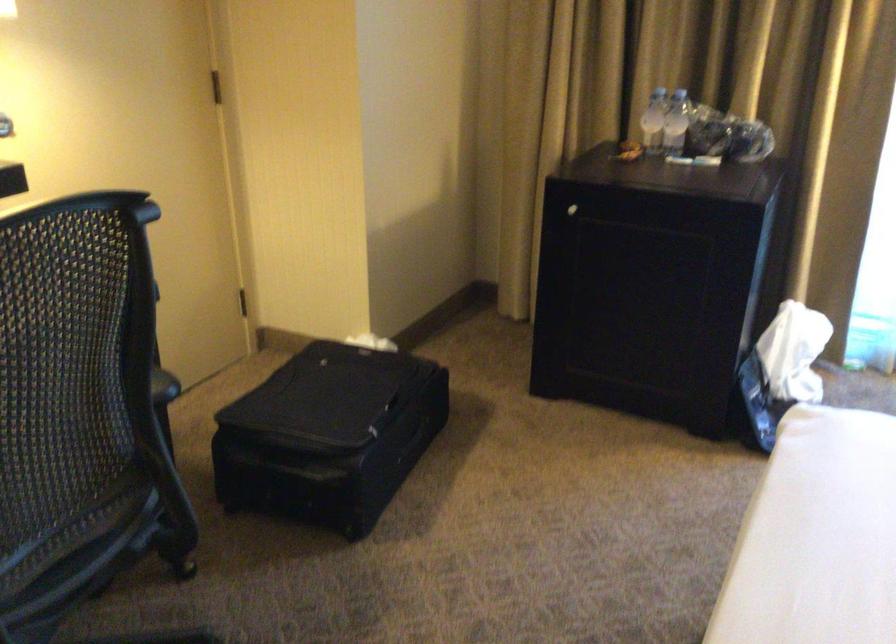
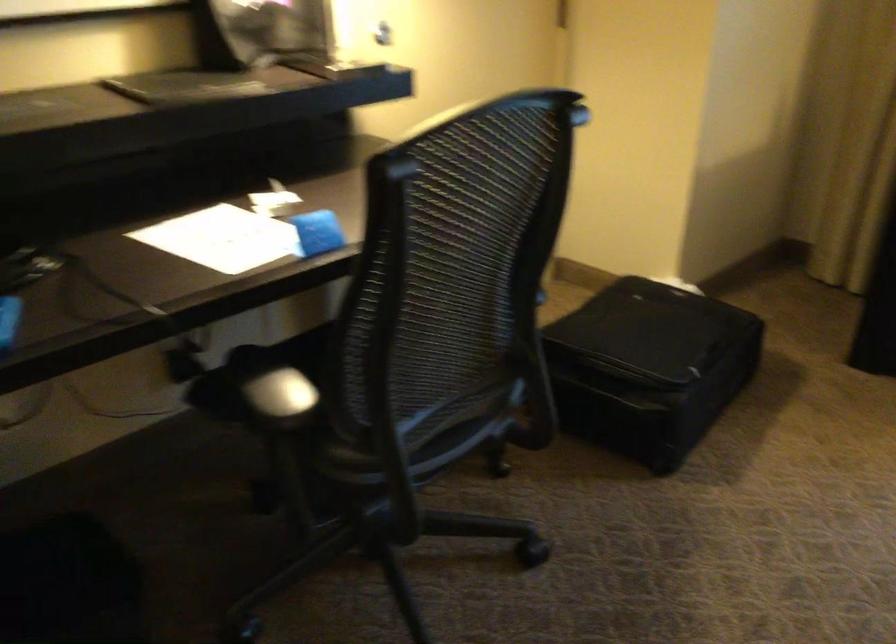
Question: Based on the continuous images, in which direction is the camera rotating? Reply with the corresponding letter.

Choices:
 (A) Left
 (B) Right
 (C) Up
 (D) Down

Answer: (A)